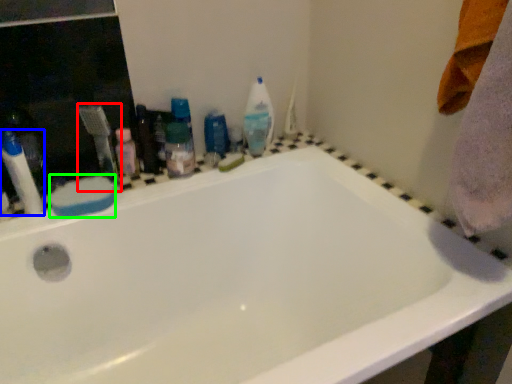
Question: Which object is the closest to the toothbrush (highlighted by a red box)? Choose among these: toiletry (highlighted by a blue box) or soap (highlighted by a green box).

Choices:
 (A) toiletry
 (B) soap

Answer: (B)